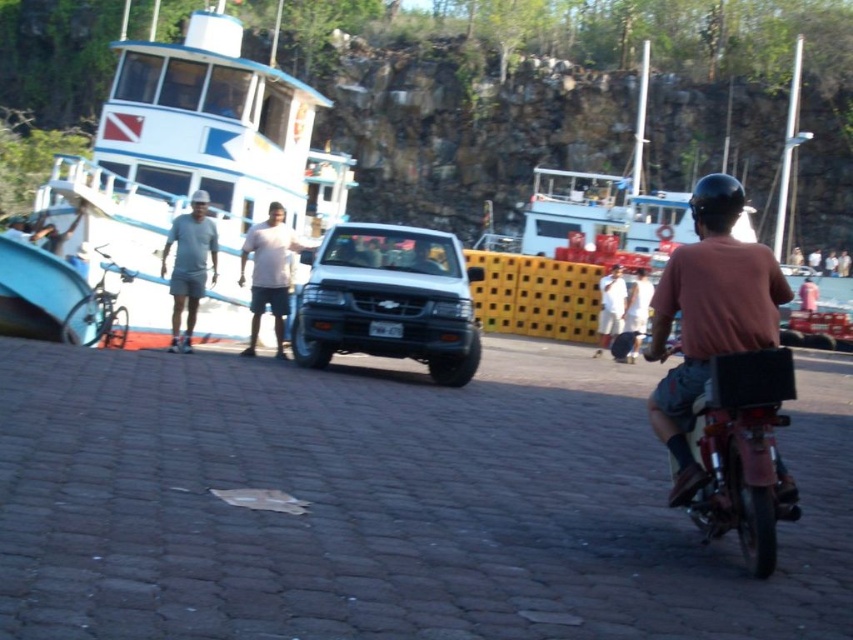
You are a photographer standing on the cobblestone pavement and want to take a photo that includes both the brown matte shirt at right and the white matte shirt at center. Which shirt should you adjust your focus on to ensure both are in the frame?

The brown matte shirt at right is in front of the white matte shirt at center, so you should focus on the brown matte shirt at right to ensure both are in the frame.

You are a delivery person who needs to park your vehicle between the white matte truck at center and the metallic red motorcycle at right. Is there enough space between them for your vehicle?

The white matte truck at center is positioned on the left side of metallic red motorcycle at right, so there is space between them for your vehicle to park.

From the picture: In the waterfront scene, there is a cobblestone pavement leading towards a group of people and vehicles. You notice a motorbike with a box on the back ridden by a man in a red shirt and black helmet positioned off to the right. Nearby, two men are near a white pickup truck. Can you identify what object or feature is located at the coordinate point (189, 266)?

The point at coordinate (189, 266) corresponds to the gray fabric shorts at left.